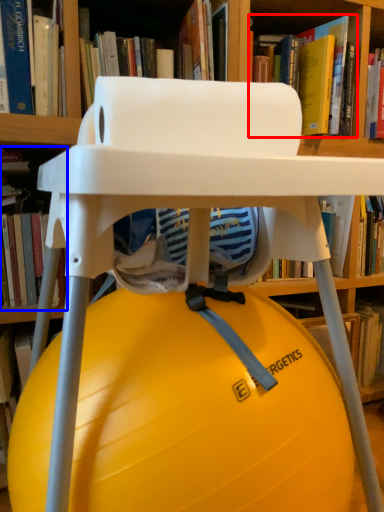
Question: Which object is further to the camera taking this photo, book (highlighted by a red box) or book (highlighted by a blue box)?

Choices:
 (A) book
 (B) book

Answer: (A)